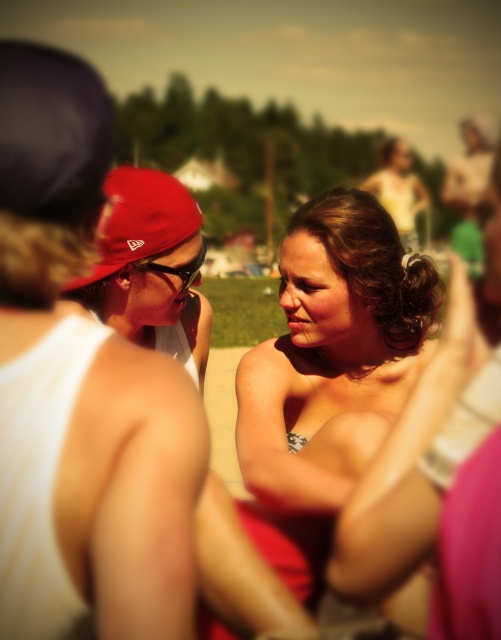
Question: Observing the image, what is the correct spatial positioning of shiny gold necklace at center in reference to matte brown hair at center?

Choices:
 (A) below
 (B) above

Answer: (A)

Question: Based on their relative distances, which object is farther from the matte brown hair at center?

Choices:
 (A) shiny gold necklace at center
 (B) matte red baseball cap at left
 (C) matte red cap at center

Answer: (B)

Question: From the image, what is the correct spatial relationship of matte red cap at center in relation to matte brown hair at center?

Choices:
 (A) right
 (B) left

Answer: (B)

Question: Which is nearer to the matte red cap at center?

Choices:
 (A) matte red baseball cap at left
 (B) shiny gold necklace at center
 (C) matte brown hair at center

Answer: (A)

Question: Which object is positioned closest to the matte red baseball cap at left?

Choices:
 (A) matte red cap at center
 (B) matte brown hair at center

Answer: (A)

Question: Does matte red cap at center come behind matte red baseball cap at left?

Choices:
 (A) no
 (B) yes

Answer: (B)